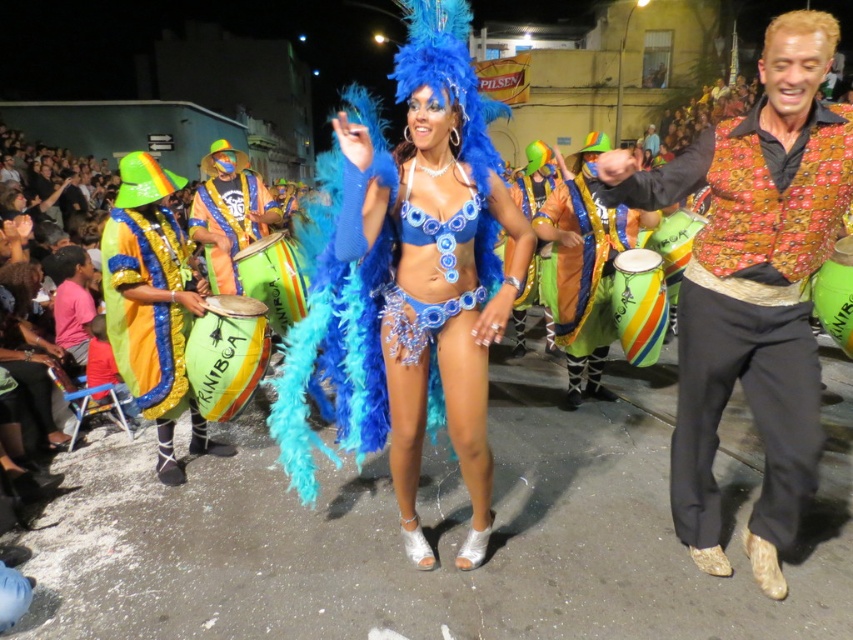
Can you confirm if floral-patterned vest at center is wider than green painted wood drum at center?

→ Indeed, floral-patterned vest at center has a greater width compared to green painted wood drum at center.

Does point (796, 220) come farther from viewer compared to point (657, 240)?

No, (796, 220) is in front of (657, 240).

Between point (695, 412) and point (691, 243), which one is positioned in front?

Positioned in front is point (695, 412).

Locate an element on the screen. floral-patterned vest at center is located at coordinates (753, 288).

Is shiny blue feathers at center bigger than green/yellow drum at center?

Yes.

Does shiny blue feathers at center lie in front of green/yellow drum at center?

Yes, shiny blue feathers at center is in front of green/yellow drum at center.

Is point (473, 308) behind point (248, 250)?

No.

The image size is (853, 640). In order to click on shiny blue feathers at center in this screenshot , I will do `click(437, 260)`.

Can you confirm if orange fabric drum at center is positioned to the right of green/yellow drum at center?

No, orange fabric drum at center is not to the right of green/yellow drum at center.

The height and width of the screenshot is (640, 853). What do you see at coordinates (228, 212) in the screenshot?
I see `orange fabric drum at center` at bounding box center [228, 212].

Who is more distant from viewer, [207,166] or [274,324]?

The point [207,166] is more distant.

Where is `orange fabric drum at center`? Image resolution: width=853 pixels, height=640 pixels. orange fabric drum at center is located at coordinates (228, 212).